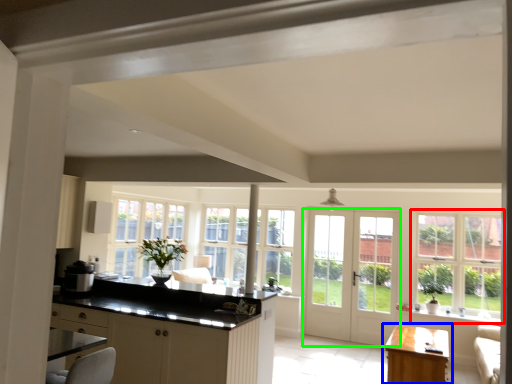
Question: Which is nearer to the window (highlighted by a red box)? table (highlighted by a blue box) or door (highlighted by a green box).

Choices:
 (A) table
 (B) door

Answer: (B)